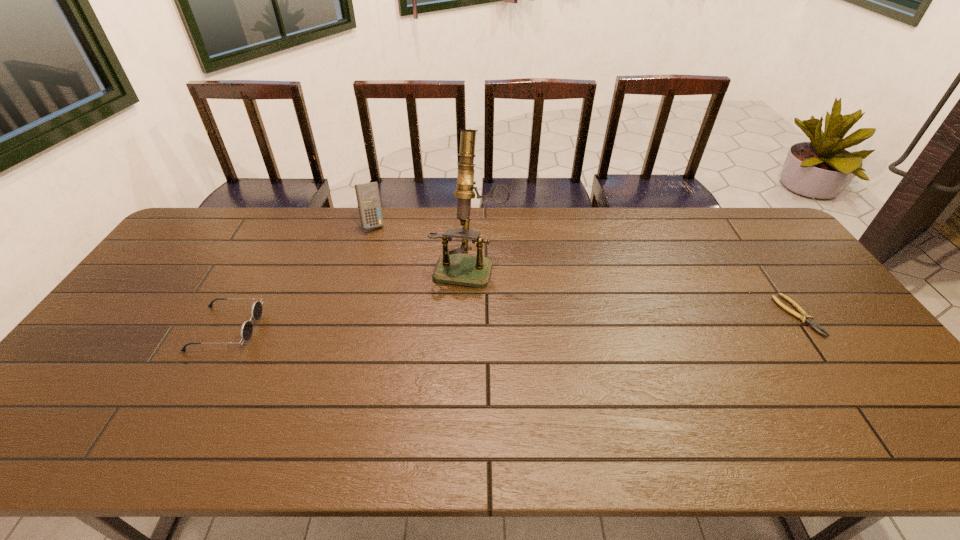
This screenshot has width=960, height=540. I want to click on free area in between the tallest object and the second tallest object, so click(421, 244).

In order to click on free space between the third object from right to left and the second shortest object in this screenshot , I will do `click(300, 276)`.

Find the location of a particular element. The image size is (960, 540). vacant region between the third object from left to right and the second shortest object is located at coordinates (348, 296).

The image size is (960, 540). In order to click on empty location between the shortest object and the second shortest object in this screenshot , I will do `click(512, 322)`.

Identify which object is located as the third nearest to the third shortest object. Please provide its 2D coordinates. Your answer should be formatted as a tuple, i.e. [(x, y)], where the tuple contains the x and y coordinates of a point satisfying the conditions above.

[(803, 316)]

The height and width of the screenshot is (540, 960). In order to click on object that stands as the third closest to the pliers in this screenshot , I will do `click(246, 330)`.

The height and width of the screenshot is (540, 960). In order to click on free location that satisfies the following two spatial constraints: 1. on the front side of the second farthest object; 2. on the right side of the second object from left to right in this screenshot , I will do `click(361, 265)`.

At what (x,y) coordinates should I click in order to perform the action: click on free region that satisfies the following two spatial constraints: 1. on the front side of the second object from right to left; 2. on the right side of the farthest object. Please return your answer as a coordinate pair (x, y). The image size is (960, 540). Looking at the image, I should click on (361, 265).